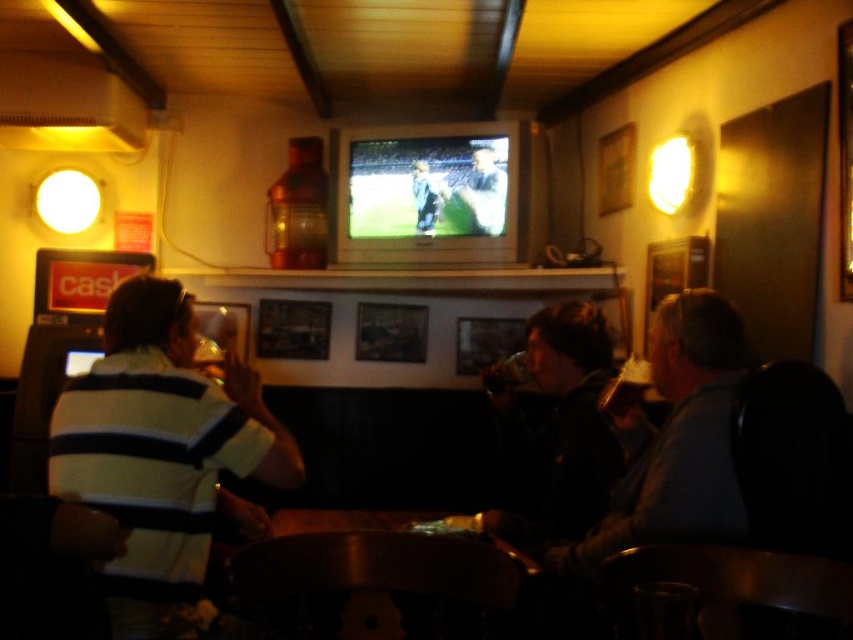
You are a customer in the bar and want to order a drink. The bartender points to the striped cotton shirt at left and dark blue jersey at center on the shelf behind the TV. Which one is located lower?

The striped cotton shirt at left is positioned under the dark blue jersey at center, so it is located lower.

You are standing at the entrance of the bar and want to point out the light blue jersey at center to a friend. Based on the coordinates given, can you describe its position relative to the TV screen?

The light blue jersey at center is located at coordinates point (483, 195). Since the TV is mounted above the shelf on the back wall, the jersey is positioned to the left of the TV screen based on the x and y coordinates provided.

What is located at the coordinates point [161,454]?

The striped cotton shirt at left is located at point [161,454].